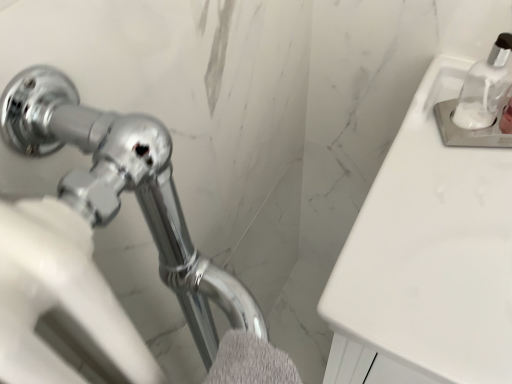
Locate an element on the screen. vacant region to the left of clear glass soap dispenser at upper right is located at coordinates (413, 152).